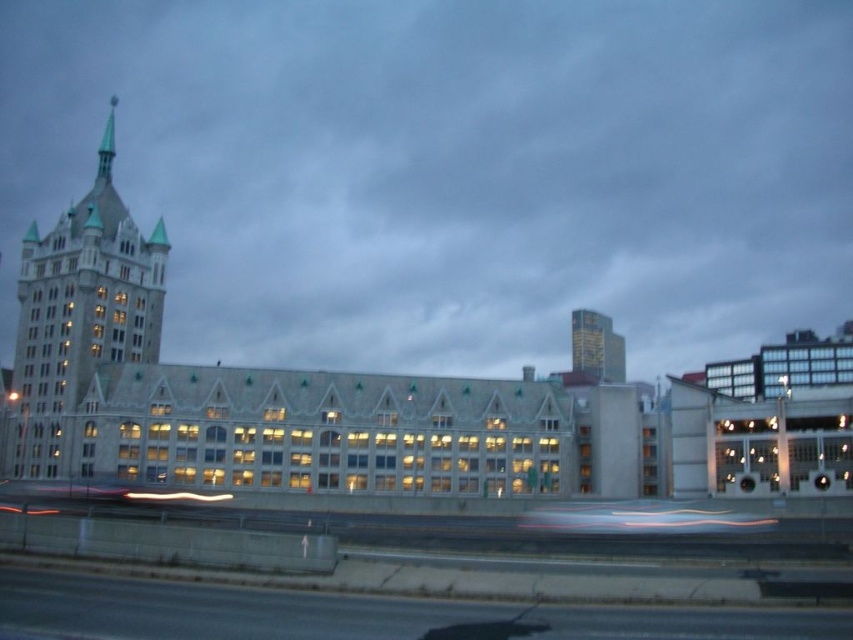
You are a drone operator tasked with taking aerial shots of the black asphalt highway at lower left and the matte stone tower at upper left. Your drone has a maximum flight range of 40 meters. Can you capture both locations in a single flight without needing to recharge?

The distance between the black asphalt highway at lower left and the matte stone tower at upper left is 41.32 meters. Since the drone can only fly up to 40 meters, it cannot reach the matte stone tower at upper left from the black asphalt highway at lower left in a single flight without recharging.

You are a photographer who wants to capture a photo of the gold metallic building at upper right without the black asphalt highway at lower left appearing in the frame. Is it possible to do so by adjusting your camera angle?

The black asphalt highway at lower left is below the gold metallic building at upper right, so by angling the camera upward to focus on the upper portion of the scene, you can exclude the highway from the frame.